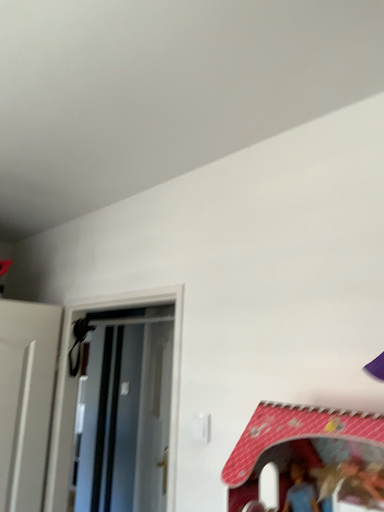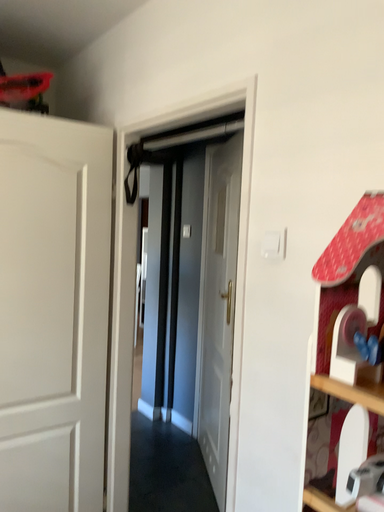
Question: Which way did the camera rotate in the video?

Choices:
 (A) rotated right
 (B) rotated left

Answer: (B)